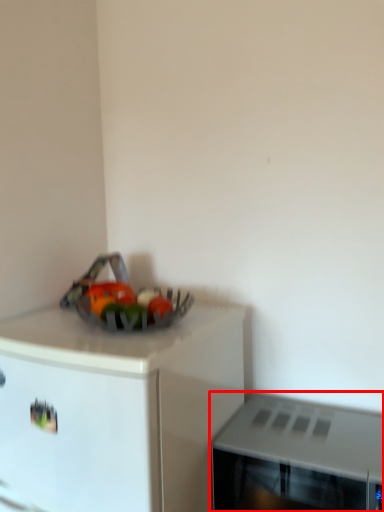
Question: Where is microwave oven (annotated by the red box) located in relation to cabinetry in the image?

Choices:
 (A) right
 (B) left

Answer: (A)